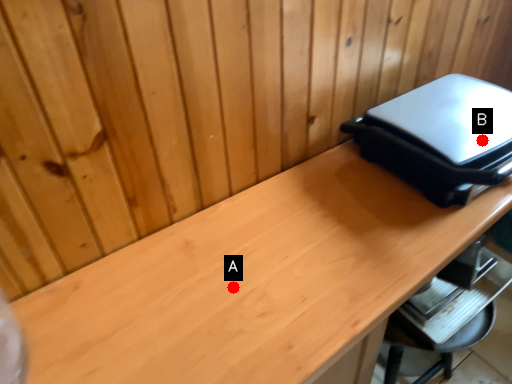
Question: Two points are circled on the image, labeled by A and B beside each circle. Which point is closer to the camera taking this photo?

Choices:
 (A) A is closer
 (B) B is closer

Answer: (A)